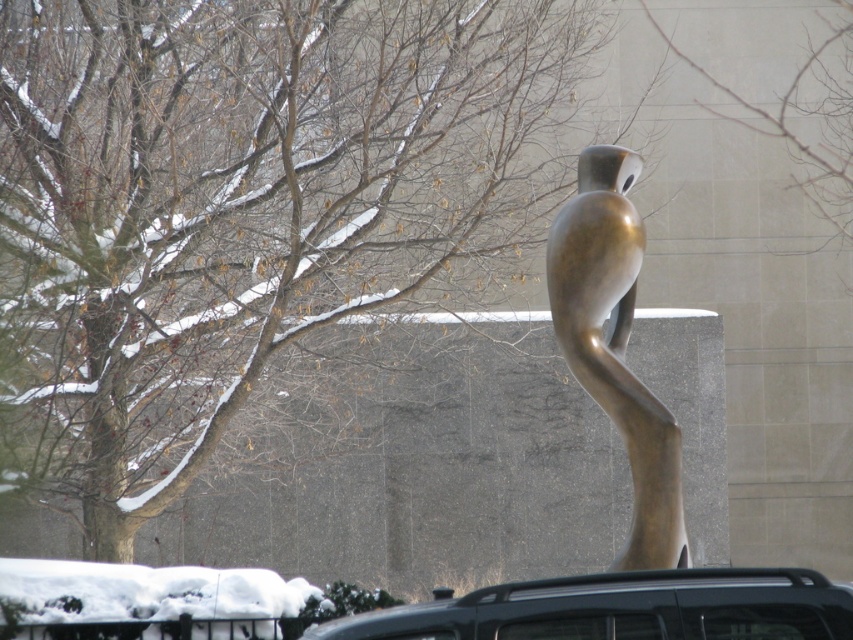
Question: Which point is closer to the camera taking this photo?

Choices:
 (A) (793, 572)
 (B) (556, 240)

Answer: (A)

Question: Observing the image, what is the correct spatial positioning of black matte car at lower center in reference to bronze sculpture at center?

Choices:
 (A) right
 (B) left

Answer: (A)

Question: Is black matte car at lower center bigger than bronze sculpture at center?

Choices:
 (A) yes
 (B) no

Answer: (A)

Question: Which point is farther to the camera?

Choices:
 (A) (757, 588)
 (B) (585, 278)

Answer: (B)

Question: Does black matte car at lower center have a larger size compared to bronze sculpture at center?

Choices:
 (A) no
 (B) yes

Answer: (B)